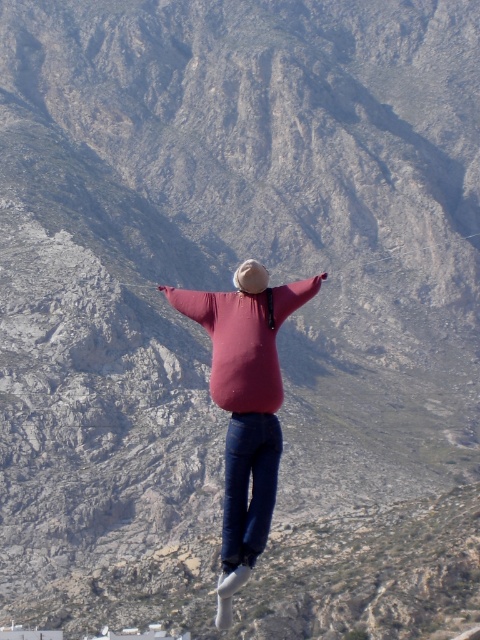
Question: Is matte pink sweater at center thinner than blue denim jeans at center?

Choices:
 (A) yes
 (B) no

Answer: (B)

Question: Which point is farther to the camera?

Choices:
 (A) blue denim jeans at center
 (B) matte pink sweater at center

Answer: (A)

Question: Is matte pink sweater at center thinner than blue denim jeans at center?

Choices:
 (A) yes
 (B) no

Answer: (B)

Question: Is matte pink sweater at center positioned before blue denim jeans at center?

Choices:
 (A) no
 (B) yes

Answer: (B)